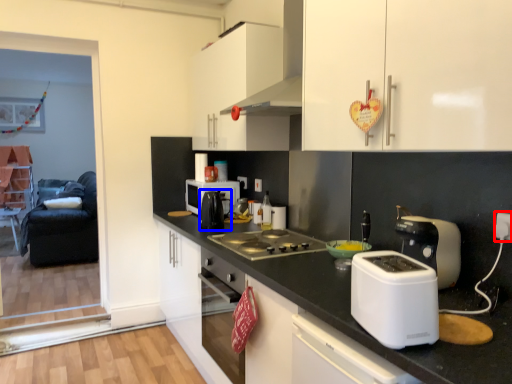
Question: Which object appears farthest to the camera in this image, electric outlet (highlighted by a red box) or tea pot (highlighted by a blue box)?

Choices:
 (A) electric outlet
 (B) tea pot

Answer: (B)